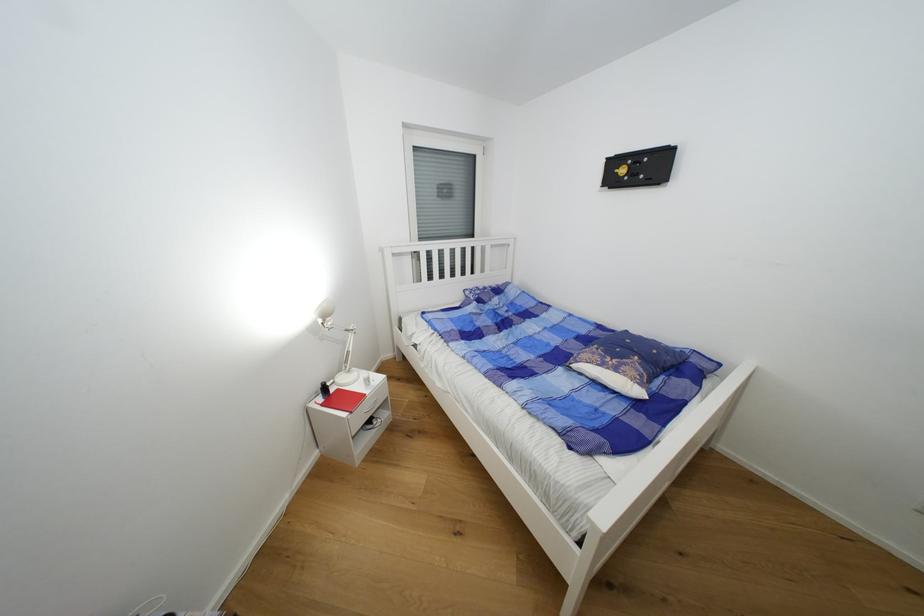
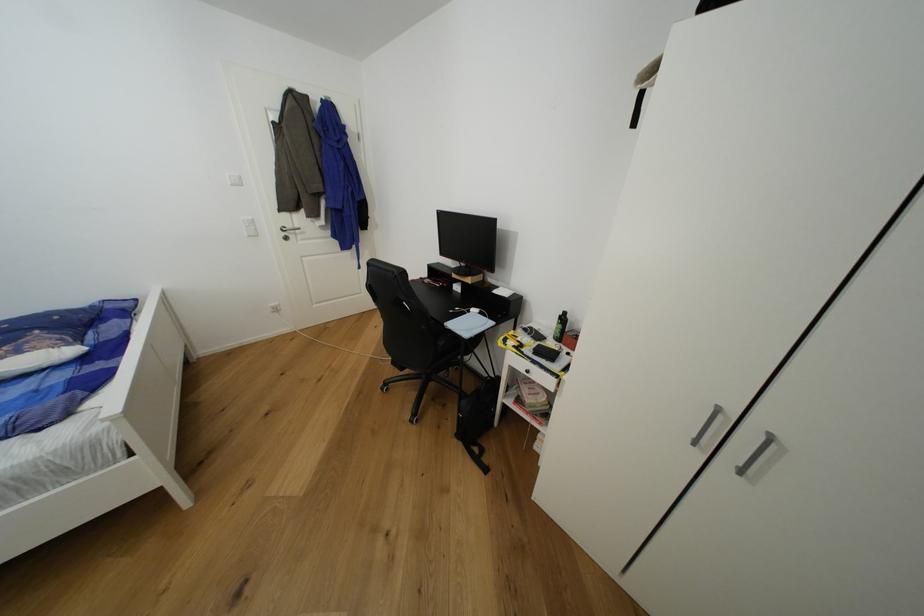
How did the camera likely rotate?

The camera rotated toward right-down.